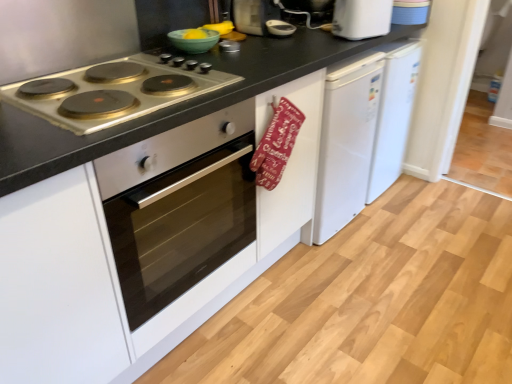
Question: Is the depth of white plastic toaster at upper right greater than that of green matte bowl at upper center?

Choices:
 (A) yes
 (B) no

Answer: (A)

Question: Does white plastic toaster at upper right have a lesser width compared to green matte bowl at upper center?

Choices:
 (A) no
 (B) yes

Answer: (B)

Question: From the image's perspective, is white plastic toaster at upper right above green matte bowl at upper center?

Choices:
 (A) no
 (B) yes

Answer: (B)

Question: Does white plastic toaster at upper right turn towards green matte bowl at upper center?

Choices:
 (A) no
 (B) yes

Answer: (A)

Question: Is the position of white plastic toaster at upper right less distant than that of green matte bowl at upper center?

Choices:
 (A) yes
 (B) no

Answer: (B)

Question: Which is correct: red fabric oven mitt at center is inside green matte bowl at upper center, or outside of it?

Choices:
 (A) outside
 (B) inside

Answer: (A)

Question: In the image, is red fabric oven mitt at center on the left side or the right side of green matte bowl at upper center?

Choices:
 (A) right
 (B) left

Answer: (A)

Question: From a real-world perspective, relative to green matte bowl at upper center, is red fabric oven mitt at center vertically above or below?

Choices:
 (A) above
 (B) below

Answer: (B)

Question: From the image's perspective, is red fabric oven mitt at center above or below green matte bowl at upper center?

Choices:
 (A) below
 (B) above

Answer: (A)

Question: Considering the relative positions of green matte bowl at upper center and satin silver oven at left in the image provided, is green matte bowl at upper center to the left or to the right of satin silver oven at left?

Choices:
 (A) left
 (B) right

Answer: (B)

Question: From the image's perspective, is green matte bowl at upper center positioned above or below satin silver oven at left?

Choices:
 (A) below
 (B) above

Answer: (B)

Question: From a real-world perspective, is green matte bowl at upper center physically located above or below satin silver oven at left?

Choices:
 (A) above
 (B) below

Answer: (A)

Question: Is green matte bowl at upper center inside or outside of satin silver oven at left?

Choices:
 (A) inside
 (B) outside

Answer: (B)

Question: From a real-world perspective, relative to green matte bowl at upper center, is white plastic toaster at upper right vertically above or below?

Choices:
 (A) below
 (B) above

Answer: (B)

Question: In the image, is white plastic toaster at upper right positioned in front of or behind green matte bowl at upper center?

Choices:
 (A) behind
 (B) front

Answer: (A)